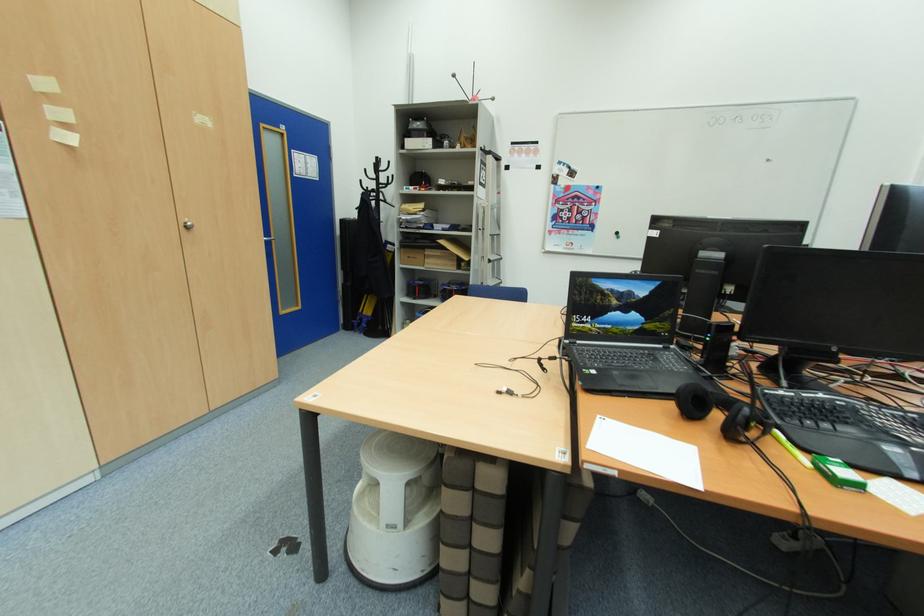
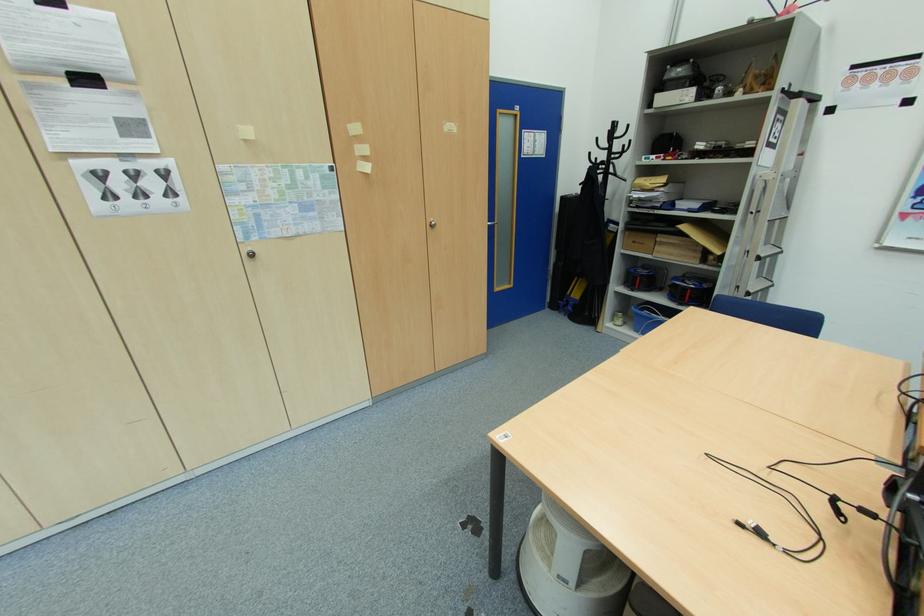
Where in the second image is the point corresponding to (419,300) from the first image?

(637, 291)